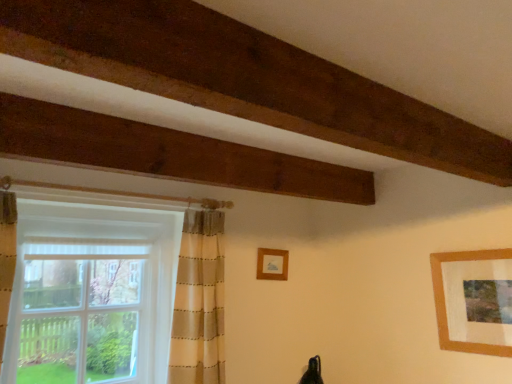
Question: From the image's perspective, is white sheer curtain at left located beneath wooden frame at center, which is counted as the 2th picture frame, starting from the right?

Choices:
 (A) no
 (B) yes

Answer: (B)

Question: From the image's perspective, is white sheer curtain at left above wooden frame at center, which is counted as the 2th picture frame, starting from the right?

Choices:
 (A) yes
 (B) no

Answer: (B)

Question: Is white sheer curtain at left at the right side of wooden frame at center, which is counted as the 2th picture frame, starting from the right?

Choices:
 (A) yes
 (B) no

Answer: (B)

Question: Is white sheer curtain at left to the left of wooden frame at center, the 1th picture frame when ordered from left to right, from the viewer's perspective?

Choices:
 (A) no
 (B) yes

Answer: (B)

Question: Is white sheer curtain at left wider than wooden frame at center, which is counted as the 2th picture frame, starting from the right?

Choices:
 (A) no
 (B) yes

Answer: (B)

Question: In terms of width, does wooden frame at center, positioned as the 1th picture frame in back-to-front order, look wider or thinner when compared to wooden picture frame at upper right, which is the first picture frame from front to back?

Choices:
 (A) thin
 (B) wide

Answer: (B)

Question: From their relative heights in the image, would you say wooden frame at center, positioned as the 1th picture frame in back-to-front order, is taller or shorter than wooden picture frame at upper right, which is the first picture frame from front to back?

Choices:
 (A) short
 (B) tall

Answer: (A)

Question: In terms of size, does wooden frame at center, which is counted as the 2th picture frame, starting from the right, appear bigger or smaller than wooden picture frame at upper right, which is the first picture frame from front to back?

Choices:
 (A) big
 (B) small

Answer: (B)

Question: From the image's perspective, relative to wooden picture frame at upper right, which is the 2th picture frame in back-to-front order, is wooden frame at center, which is counted as the 2th picture frame, starting from the right, above or below?

Choices:
 (A) below
 (B) above

Answer: (B)

Question: In terms of width, does white sheer curtain at left look wider or thinner when compared to wooden frame at center, which ranks as the 2th picture frame in front-to-back order?

Choices:
 (A) thin
 (B) wide

Answer: (B)

Question: Is white sheer curtain at left inside or outside of wooden frame at center, which ranks as the 2th picture frame in front-to-back order?

Choices:
 (A) inside
 (B) outside

Answer: (B)

Question: Is point (95, 317) positioned closer to the camera than point (260, 271)?

Choices:
 (A) farther
 (B) closer

Answer: (B)

Question: In terms of height, does white sheer curtain at left look taller or shorter compared to wooden frame at center, which ranks as the 2th picture frame in front-to-back order?

Choices:
 (A) tall
 (B) short

Answer: (A)

Question: Does point (444, 324) appear closer or farther from the camera than point (56, 223)?

Choices:
 (A) farther
 (B) closer

Answer: (A)

Question: Based on their sizes in the image, would you say wooden picture frame at upper right, which is the first picture frame from front to back, is bigger or smaller than white sheer curtain at left?

Choices:
 (A) big
 (B) small

Answer: (B)